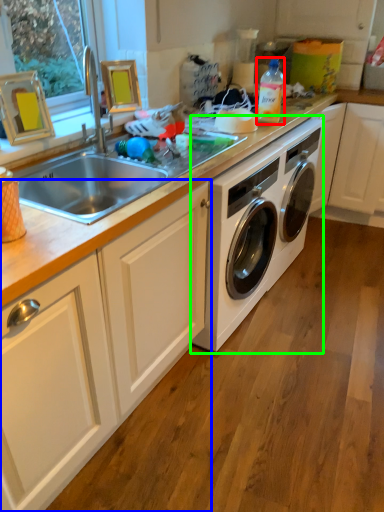
Question: Which is farther away from bottle (highlighted by a red box)? cabinetry (highlighted by a blue box) or washing machine (highlighted by a green box)?

Choices:
 (A) cabinetry
 (B) washing machine

Answer: (A)